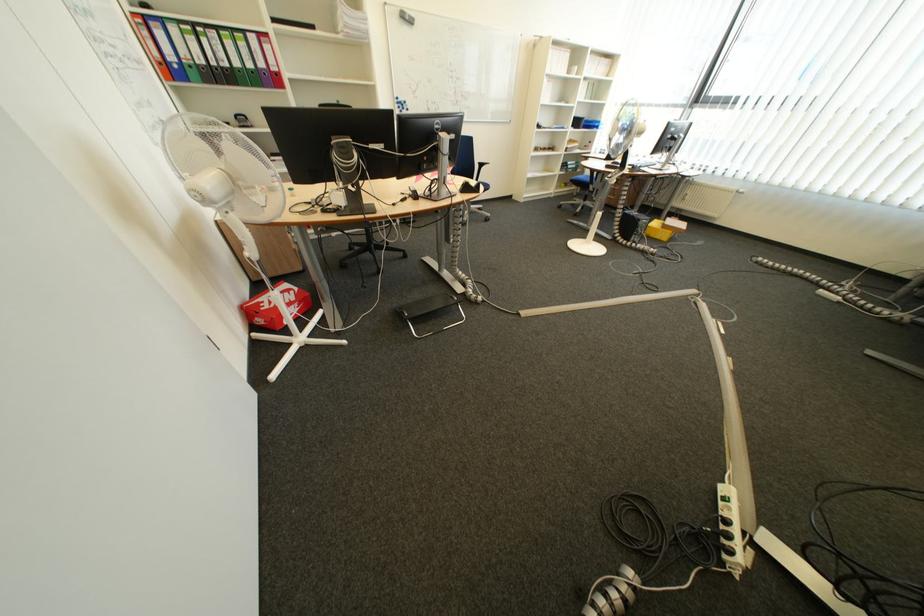
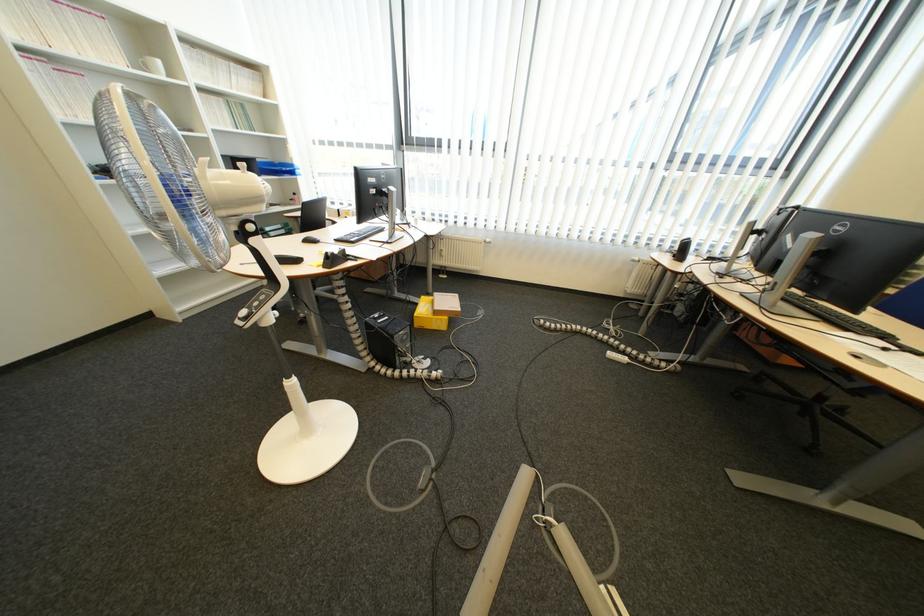
The point at (565, 197) is marked in the first image. Where is the corresponding point in the second image?

(277, 285)